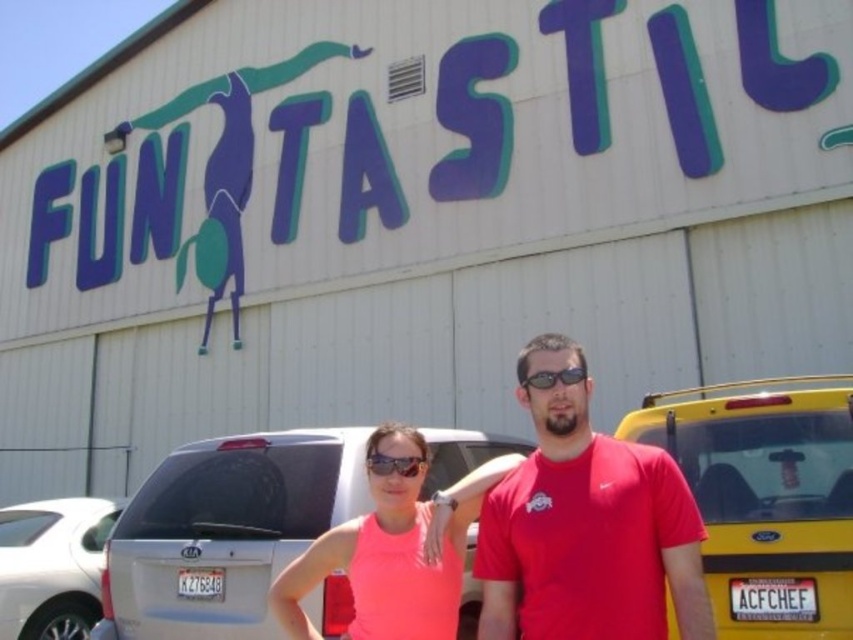
You are standing at the point marked as point (766, 497). What object is located exactly at this point?

The yellow matte taxi at right is located exactly at point (766, 497).

Looking at this image, you are a photographer positioned at the entrance of the building. You need to capture a photo that includes both the white glossy sedan at lower left and the sunglasses at center. Based on their positions, which object should you adjust your camera angle to include first?

The white glossy sedan at lower left is to the left of sunglasses at center, so you should adjust your camera angle to include the white glossy sedan at lower left first before capturing the sunglasses at center.

You are a photographer trying to capture both the yellow matte taxi at right and the pink matte tank top at center in the same frame. Based on their sizes in the image, which object should you focus on first to ensure both are clearly visible?

The yellow matte taxi at right is smaller than the pink matte tank top at center. To ensure both are clearly visible, focus on the yellow matte taxi at right first since it is smaller and might require adjusting the camera settings for clarity.